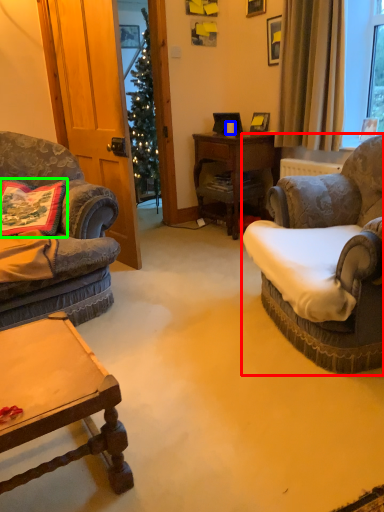
Question: Which object is positioned farthest from chair (highlighted by a red box)? Select from coffee cup (highlighted by a blue box) and pillow (highlighted by a green box).

Choices:
 (A) coffee cup
 (B) pillow

Answer: (A)